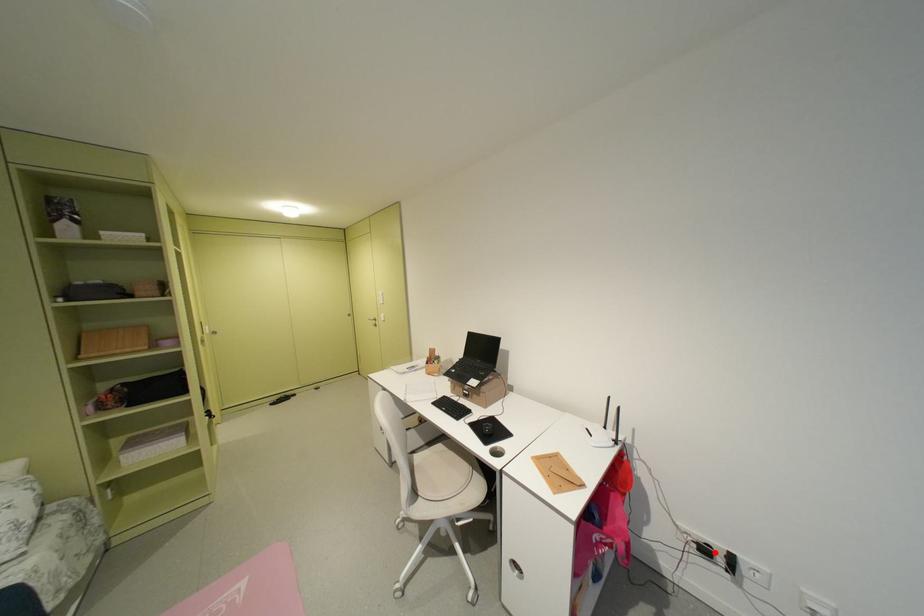
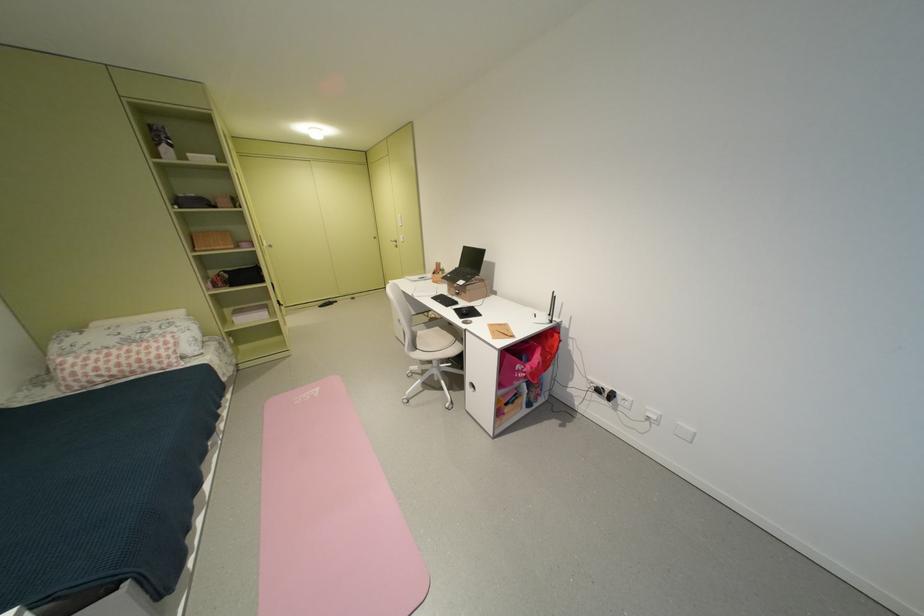
Question: A red point is marked in image1. In image2, is the corresponding 3D point closer to the camera or farther? Reply with the corresponding letter.

Choices:
 (A) The corresponding 3D point is closer.
 (B) The corresponding 3D point is farther.

Answer: (B)